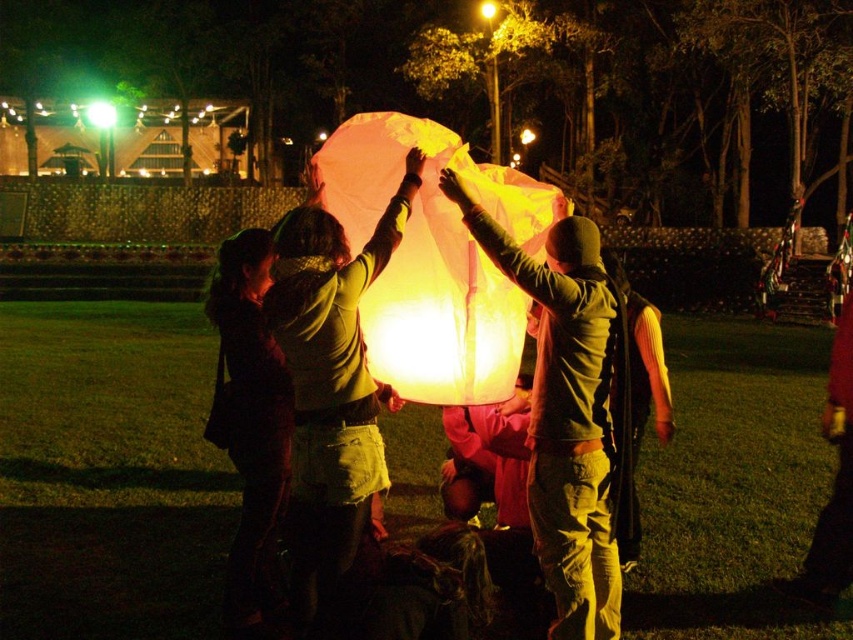
You are standing in the nighttime scene with the group holding the lantern. You notice two points marked in the image. Which point, point (461, 289) or point (608, 452), is closer to you?

Point (461, 289) is closer to you because it is further to the viewer than point (608, 452).

You are organizing a night event and want to ensure safety. The translucent paper lantern at center and the matte yellow balloon at center are both at the center. Since they are close, do you think there is a risk of the balloon getting tangled with the lantern?

The translucent paper lantern at center and the matte yellow balloon at center are 44.27 centimeters apart, which is a close proximity. There is a risk of the balloon getting tangled with the lantern due to their proximity.

You are at a nighttime event and want to take a photo of both the translucent paper lantern at center and the matte yellow balloon at center. However, you can only focus on one object at a time. Which object should you focus on to ensure the other is still in the background?

You should focus on the translucent paper lantern at center because the matte yellow balloon at center is behind it, so focusing on the lantern will keep the balloon in the background.